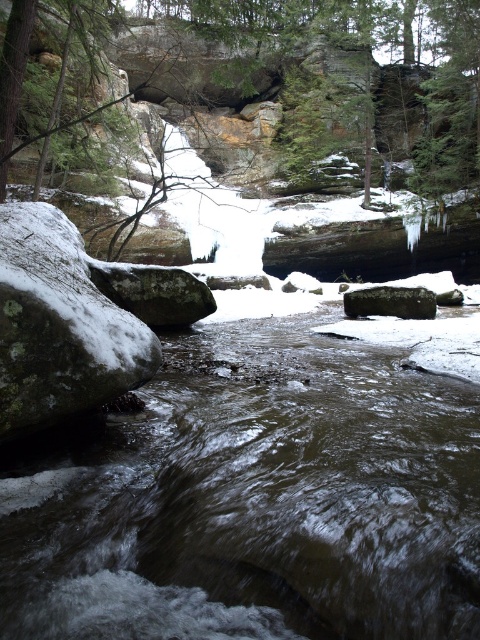
Question: From the image, what is the correct spatial relationship of lichen-covered rock at left in relation to smooth gray rock at center?

Choices:
 (A) above
 (B) below

Answer: (A)

Question: Among these points, which one is farthest from the camera?

Choices:
 (A) 56,129
 (B) 352,317
 (C) 121,346

Answer: (B)

Question: Is lichen-covered rock at left to the right of smooth gray rock at center from the viewer's perspective?

Choices:
 (A) yes
 (B) no

Answer: (B)

Question: Can you confirm if lichen-covered rock at left is positioned above green textured tree at upper center?

Choices:
 (A) no
 (B) yes

Answer: (A)

Question: Which point is farther to the camera?

Choices:
 (A) smooth gray rock at center
 (B) lichen-covered rock at left

Answer: (A)

Question: Which point appears farthest from the camera in this image?

Choices:
 (A) (387, 292)
 (B) (15, 396)
 (C) (2, 144)

Answer: (A)